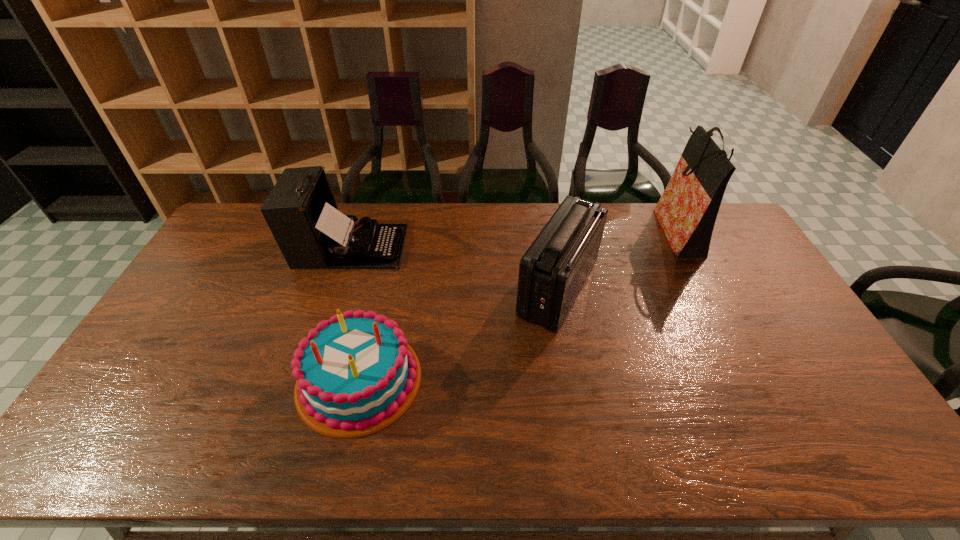
Locate an element on the screen. This screenshot has width=960, height=540. vacant space at the left edge is located at coordinates (145, 365).

Image resolution: width=960 pixels, height=540 pixels. I want to click on vacant space at the right edge of the desktop, so click(x=725, y=273).

The width and height of the screenshot is (960, 540). I want to click on vacant space that's between the rightmost object and the radio receiver, so click(x=618, y=259).

In order to click on free space that is in between the radio receiver and the typewriter in this screenshot , I will do `click(454, 267)`.

Where is `vacant point located between the third object from left to right and the tallest object`? Image resolution: width=960 pixels, height=540 pixels. vacant point located between the third object from left to right and the tallest object is located at coordinates (618, 259).

Locate an element on the screen. This screenshot has height=540, width=960. unoccupied position between the rightmost object and the typewriter is located at coordinates (515, 238).

Where is `the second closest object to the rightmost object`? The width and height of the screenshot is (960, 540). the second closest object to the rightmost object is located at coordinates (355, 373).

Select which object is the third closest to the shortest object. Please provide its 2D coordinates. Your answer should be formatted as a tuple, i.e. [(x, y)], where the tuple contains the x and y coordinates of a point satisfying the conditions above.

[(687, 210)]

The height and width of the screenshot is (540, 960). What are the coordinates of `free point that satisfies the following two spatial constraints: 1. on the back side of the birthday cake; 2. inside the open case of the typewriter` in the screenshot? It's located at (390, 246).

The width and height of the screenshot is (960, 540). I want to click on vacant region that satisfies the following two spatial constraints: 1. inside the open case of the typewriter; 2. on the left side of the birthday cake, so click(x=306, y=380).